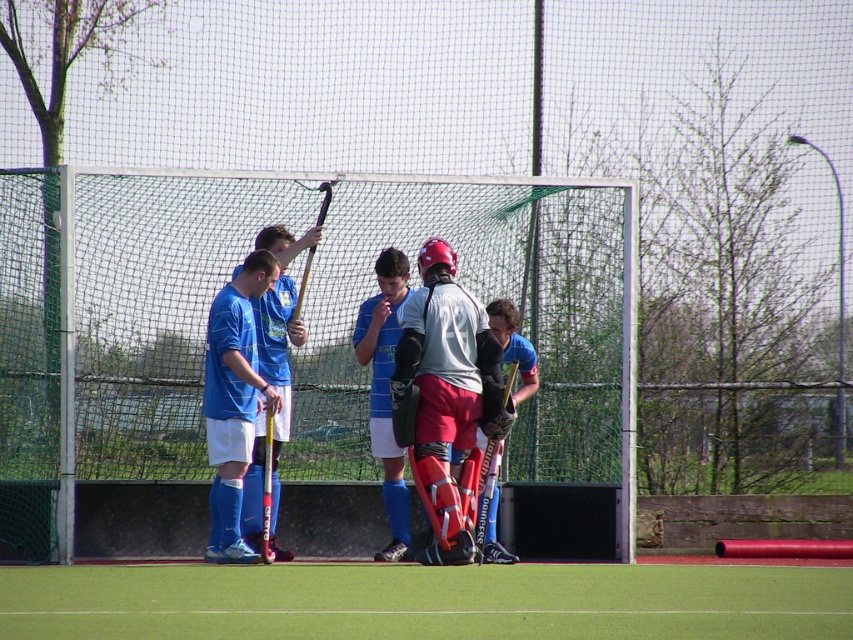
Question: Which object appears farthest from the camera in this image?

Choices:
 (A) green artificial turf at center
 (B) blue striped jersey at center
 (C) matte blue shirt at center
 (D) matte black hockey stick at center

Answer: (D)

Question: Which point appears closest to the camera in this image?

Choices:
 (A) pos(270,276)
 (B) pos(265,234)
 (C) pos(398,544)

Answer: (A)

Question: Is blue jersey at left above blue striped jersey at center?

Choices:
 (A) yes
 (B) no

Answer: (A)

Question: Is matte blue shirt at center above blue striped jersey at center?

Choices:
 (A) yes
 (B) no

Answer: (A)

Question: Which object is farther from the camera taking this photo?

Choices:
 (A) green artificial turf at center
 (B) matte blue shirt at center
 (C) blue striped jersey at center
 (D) matte gray jersey at center

Answer: (C)

Question: Is blue jersey at left to the left of blue striped jersey at center from the viewer's perspective?

Choices:
 (A) no
 (B) yes

Answer: (B)